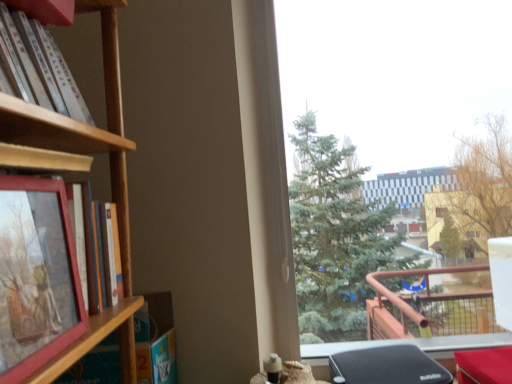
Question: Is white matte book at upper left, arranged as the 1th book when viewed from the top, completely or partially outside of transparent glass window at upper right?

Choices:
 (A) no
 (B) yes

Answer: (B)

Question: From a real-world perspective, does white matte book at upper left, which ranks as the second book in bottom-to-top order, stand above transparent glass window at upper right?

Choices:
 (A) no
 (B) yes

Answer: (B)

Question: Are white matte book at upper left, which ranks as the second book in bottom-to-top order, and transparent glass window at upper right located far from each other?

Choices:
 (A) no
 (B) yes

Answer: (B)

Question: Is white matte book at upper left, arranged as the 1th book when viewed from the top, taller than transparent glass window at upper right?

Choices:
 (A) no
 (B) yes

Answer: (A)

Question: Does white matte book at upper left, which ranks as the second book in bottom-to-top order, have a larger size compared to transparent glass window at upper right?

Choices:
 (A) no
 (B) yes

Answer: (A)

Question: From the image's perspective, is white matte book at upper left, which ranks as the second book in bottom-to-top order, beneath transparent glass window at upper right?

Choices:
 (A) yes
 (B) no

Answer: (B)

Question: From a real-world perspective, is matte wooden picture frame at left located higher than matte wooden book at left, marked as the first book in a bottom-to-top arrangement?

Choices:
 (A) yes
 (B) no

Answer: (A)

Question: Is matte wooden picture frame at left touching matte wooden book at left, which is the second book from top to bottom?

Choices:
 (A) yes
 (B) no

Answer: (B)

Question: Can you confirm if matte wooden picture frame at left is bigger than matte wooden book at left, marked as the first book in a bottom-to-top arrangement?

Choices:
 (A) no
 (B) yes

Answer: (B)

Question: Considering the relative sizes of matte wooden picture frame at left and matte wooden book at left, which is the second book from top to bottom, in the image provided, is matte wooden picture frame at left smaller than matte wooden book at left, which is the second book from top to bottom,?

Choices:
 (A) yes
 (B) no

Answer: (B)

Question: Does matte wooden picture frame at left lie behind matte wooden book at left, which is the second book from top to bottom?

Choices:
 (A) no
 (B) yes

Answer: (A)

Question: From a real-world perspective, is matte wooden picture frame at left physically below matte wooden book at left, which is the second book from top to bottom?

Choices:
 (A) no
 (B) yes

Answer: (A)

Question: Does transparent glass window at upper right touch matte wooden picture frame at left?

Choices:
 (A) yes
 (B) no

Answer: (B)